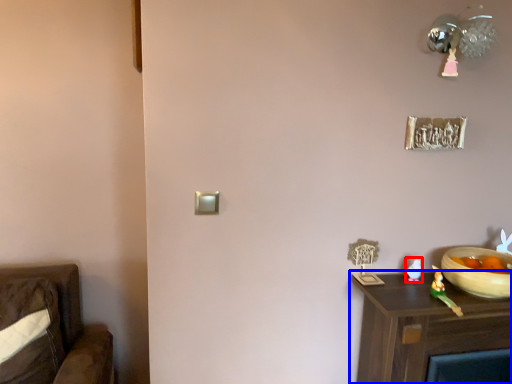
Question: Among these objects, which one is farthest to the camera, toy (highlighted by a red box) or nightstand (highlighted by a blue box)?

Choices:
 (A) toy
 (B) nightstand

Answer: (A)